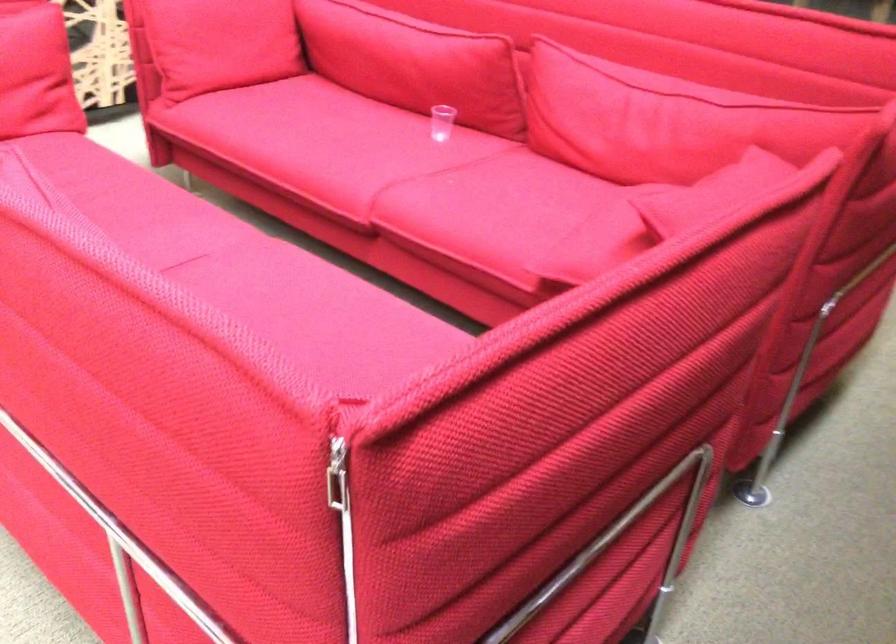
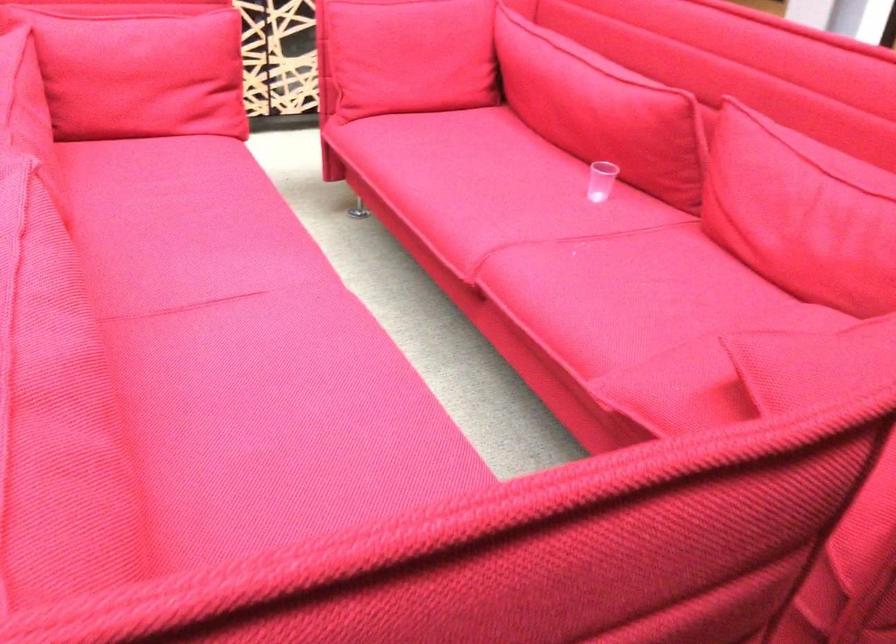
Locate, in the second image, the point that corresponds to the point at 718,263 in the first image.

(581, 542)